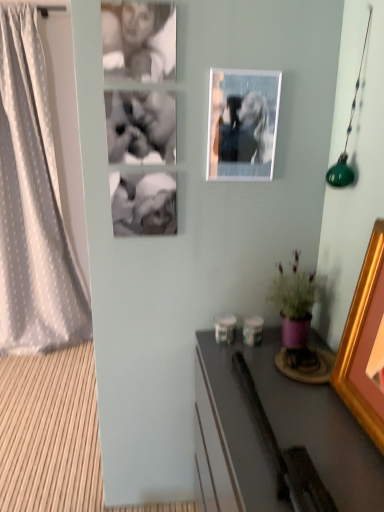
Question: Does gold wooden picture frame at right, acting as the first picture frame starting from the bottom, have a smaller size compared to smooth gray desk at lower right?

Choices:
 (A) no
 (B) yes

Answer: (B)

Question: Is gold wooden picture frame at right, marked as the second picture frame in a left-to-right arrangement, shorter than smooth gray desk at lower right?

Choices:
 (A) no
 (B) yes

Answer: (B)

Question: Is gold wooden picture frame at right, which is counted as the first picture frame, starting from the front, far from smooth gray desk at lower right?

Choices:
 (A) yes
 (B) no

Answer: (B)

Question: Is gold wooden picture frame at right, marked as the 1th picture frame in a right-to-left arrangement, positioned beyond the bounds of smooth gray desk at lower right?

Choices:
 (A) yes
 (B) no

Answer: (A)

Question: Is gold wooden picture frame at right, marked as the second picture frame in a left-to-right arrangement, aimed at smooth gray desk at lower right?

Choices:
 (A) yes
 (B) no

Answer: (B)

Question: Does gold wooden picture frame at right, the second picture frame in the top-to-bottom sequence, have a greater width compared to smooth gray desk at lower right?

Choices:
 (A) yes
 (B) no

Answer: (B)

Question: From a real-world perspective, is purple matte pot at lower right beneath smooth gray desk at lower right?

Choices:
 (A) yes
 (B) no

Answer: (B)

Question: Does purple matte pot at lower right have a greater height compared to smooth gray desk at lower right?

Choices:
 (A) no
 (B) yes

Answer: (A)

Question: Is the position of purple matte pot at lower right less distant than that of smooth gray desk at lower right?

Choices:
 (A) yes
 (B) no

Answer: (B)

Question: Does purple matte pot at lower right have a lesser width compared to smooth gray desk at lower right?

Choices:
 (A) yes
 (B) no

Answer: (A)

Question: From the image's perspective, is purple matte pot at lower right located above smooth gray desk at lower right?

Choices:
 (A) yes
 (B) no

Answer: (A)

Question: Would you say smooth gray desk at lower right is part of purple matte pot at lower right's contents?

Choices:
 (A) no
 (B) yes

Answer: (A)

Question: Is the surface of purple matte pot at lower right in direct contact with gold wooden picture frame at right, acting as the first picture frame starting from the bottom?

Choices:
 (A) yes
 (B) no

Answer: (B)